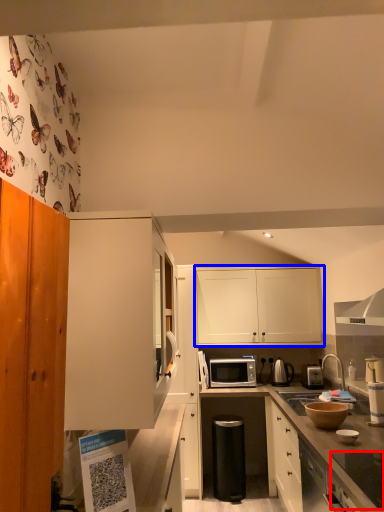
Question: Which of the following is the closest to the observer, appliance (highlighted by a red box) or cabinetry (highlighted by a blue box)?

Choices:
 (A) appliance
 (B) cabinetry

Answer: (A)